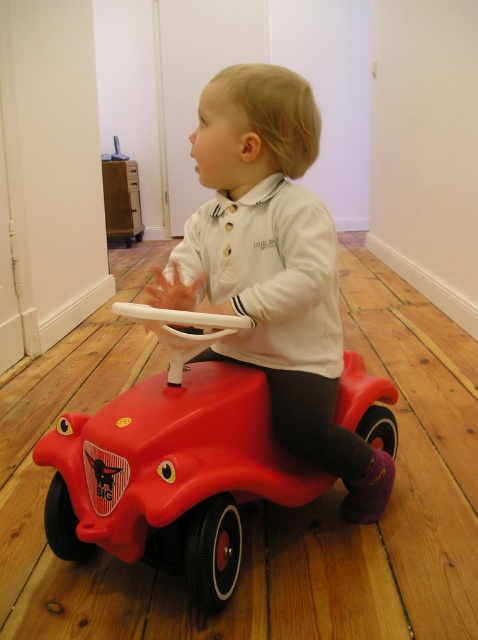
You are a photographer setting up a shot in the room. You need to place two markers at the two points. Which of the two points, point (341, 390) or point (300, 298), is closer to the camera?

Point (341, 390) is closer to the camera than point (300, 298) because it is further to the viewer according to the description.

You are a parent trying to locate your child who is sitting on the red toy car at center. The room has wooden flooring and white walls. You remember that the red toy car at center was placed at coordinates point (172,465). If you are standing at the entrance of the room, which direction should you look to find the red toy car at center?

The point (172,465) corresponds to the red toy car at center, so you should look towards the center of the room to find the red toy car at center.

You are a parent standing in the room where the rubberized matte red toy car at center is located. You want to hand your child a juice box without bending down. Can you reach the child while standing upright?

The rubberized matte red toy car at center and viewer are 34.78 inches apart from each other. Since the toy car is at the center and the parent is standing upright, the distance is about 34.78 inches, so the parent can likely reach the child without bending down, as this distance is within typical arm reach for an adult.